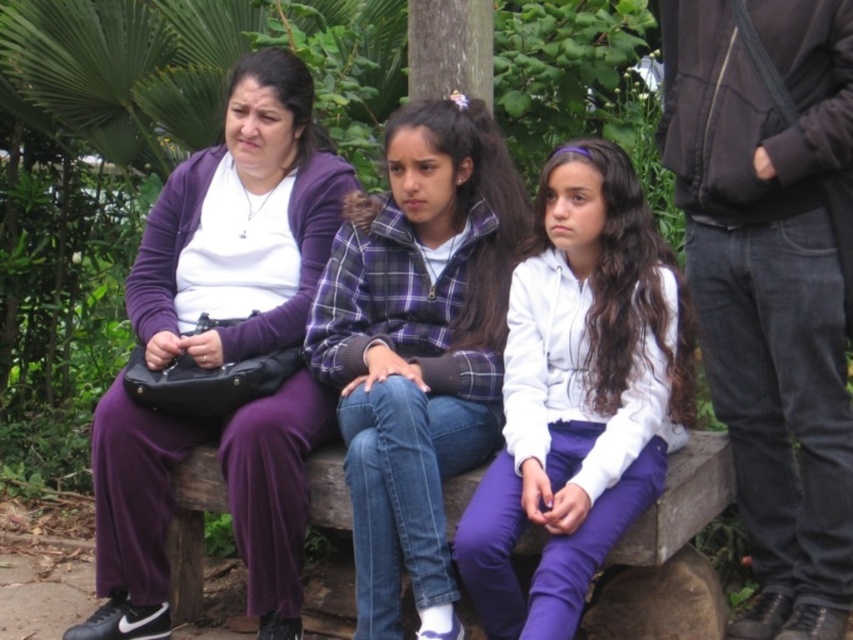
Measure the distance from plaid fabric jacket at center to white matte jacket at center.

17.68 inches

Does plaid fabric jacket at center have a greater height compared to white matte jacket at center?

Yes, plaid fabric jacket at center is taller than white matte jacket at center.

Identify the location of plaid fabric jacket at center. The image size is (853, 640). (418, 346).

Where is `plaid fabric jacket at center`? This screenshot has height=640, width=853. plaid fabric jacket at center is located at coordinates (418, 346).

Is purple matte pants at left smaller than plaid fabric jacket at center?

No.

From the picture: How distant is purple matte pants at left from plaid fabric jacket at center?

purple matte pants at left is 21.65 inches away from plaid fabric jacket at center.

The width and height of the screenshot is (853, 640). Identify the location of purple matte pants at left. (241, 225).

You are a GUI agent. You are given a task and a screenshot of the screen. Output one action in this format:
    pyautogui.click(x=<x>, y=<y>)
    Task: Click on the purple matte pants at left
    
    Given the screenshot: What is the action you would take?
    pyautogui.click(x=241, y=225)

Can you confirm if purple matte pants at left is taller than white matte jacket at center?

Correct, purple matte pants at left is much taller as white matte jacket at center.

Describe the element at coordinates (241, 225) in the screenshot. I see `purple matte pants at left` at that location.

I want to click on purple matte pants at left, so click(241, 225).